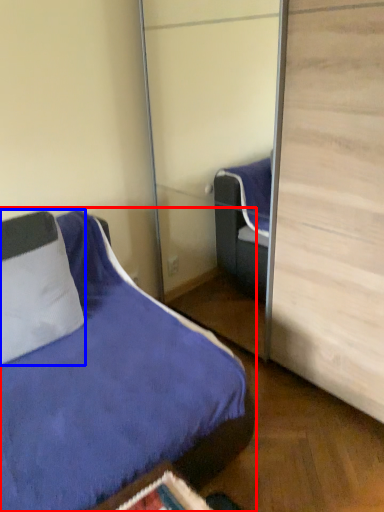
Question: Which of the following is the farthest to the observer, bed (highlighted by a red box) or pillow (highlighted by a blue box)?

Choices:
 (A) bed
 (B) pillow

Answer: (B)